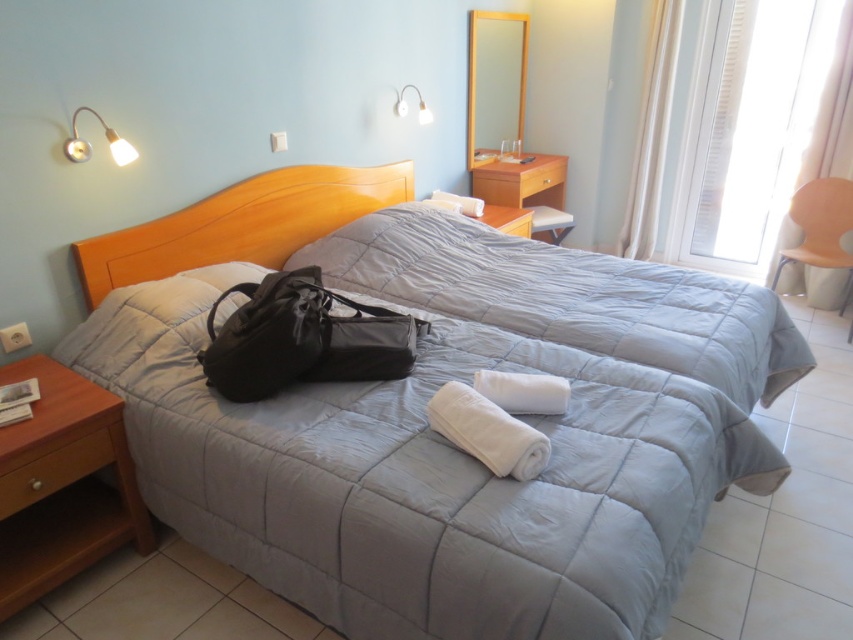
Where is the gray quilted blanket at center located in the image?

The gray quilted blanket at center is located at point (x=570, y=298).

You are a delivery person who needs to place a package on the bed in the bedroom. The package is 3 feet long. Can you fit it diagonally between the gray quilted blanket at center and the white fabric lampshade at upper center?

The gray quilted blanket at center is 4.02 feet away from the white fabric lampshade at upper center. Since the package is 3 feet long, it can fit diagonally between them as the distance between the two objects is greater than the package length.